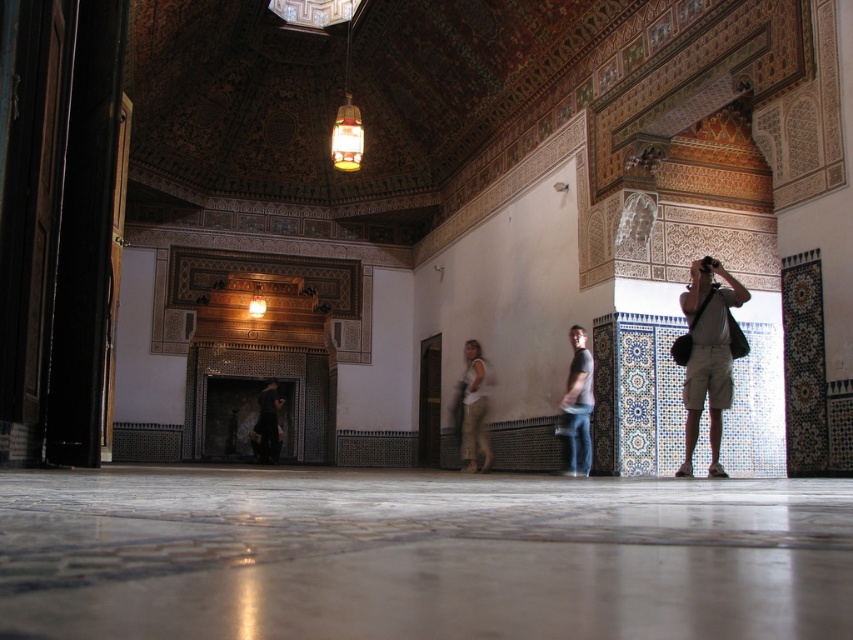
You are standing in the interior space and want to determine which of the two points, point (461, 432) or point (279, 401), is closer to you. Based on the scene description, which point is nearer?

Point (461, 432) is closer to the camera than point (279, 401), so it is nearer to you.

You are a customer in a store and see the light beige shorts at right and the dark brown leather jacket at center. Which item is taller?

The light beige shorts at right is taller than the dark brown leather jacket at center.

You are standing in the room and want to place a new painting on the wall. The painting is 0.5 meters wide. The wall has a decorative tile section with blue and white patterns. Where should you place the painting so it doesn not overlap with the denim jeans at center?

The denim jeans at center is located at point (577, 406). To avoid overlapping, place the painting on the wall in an area away from that coordinate, such as the blue and white patterned tiles section which is positioned lower on the wall.